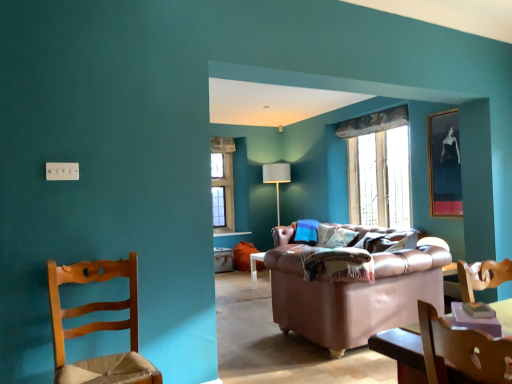
Question: Considering the positions of wooden chair at left and matte black picture frame at upper right in the image, is wooden chair at left bigger or smaller than matte black picture frame at upper right?

Choices:
 (A) big
 (B) small

Answer: (A)

Question: Would you say wooden chair at left is inside or outside matte black picture frame at upper right?

Choices:
 (A) inside
 (B) outside

Answer: (B)

Question: Which object is the closest to the soft blue fabric pillow at center?

Choices:
 (A) white plastic electric outlet at upper left
 (B) leather couch at center
 (C) clear glass window at center
 (D) matte black picture frame at upper right
 (E) wooden chair at left

Answer: (C)

Question: Considering the real-world distances, which object is closest to the white plastic electric outlet at upper left?

Choices:
 (A) leather couch at center
 (B) clear glass window at center
 (C) soft blue fabric pillow at center
 (D) matte black picture frame at upper right
 (E) wooden chair at left

Answer: (E)